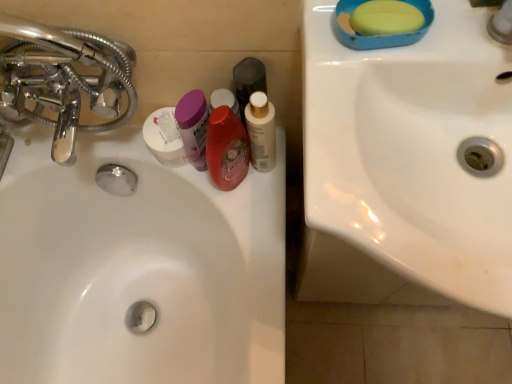
Question: From the image's perspective, does purple plastic container at center, the fourth mouthwash when ordered from right to left, appear lower than white matte container at center?

Choices:
 (A) yes
 (B) no

Answer: (A)

Question: From a real-world perspective, is purple plastic container at center, the first mouthwash positioned from the left, under white matte container at center?

Choices:
 (A) yes
 (B) no

Answer: (B)

Question: Is white matte container at center a part of purple plastic container at center, the first mouthwash positioned from the left?

Choices:
 (A) no
 (B) yes

Answer: (A)

Question: Can you confirm if purple plastic container at center, the first mouthwash positioned from the left, is positioned to the left of white matte container at center?

Choices:
 (A) yes
 (B) no

Answer: (B)

Question: Can you confirm if purple plastic container at center, the fourth mouthwash when ordered from right to left, is wider than white matte container at center?

Choices:
 (A) yes
 (B) no

Answer: (B)

Question: Is translucent purple mouthwash at center, which is the second mouthwash in left-to-right order, inside or outside of white matte container at center?

Choices:
 (A) inside
 (B) outside

Answer: (B)

Question: From a real-world perspective, is translucent purple mouthwash at center, the third mouthwash from the right, above or below white matte container at center?

Choices:
 (A) below
 (B) above

Answer: (B)

Question: Is translucent purple mouthwash at center, the third mouthwash from the right, bigger or smaller than white matte container at center?

Choices:
 (A) big
 (B) small

Answer: (A)

Question: Visually, is translucent purple mouthwash at center, the third mouthwash from the right, positioned to the left or to the right of white matte container at center?

Choices:
 (A) left
 (B) right

Answer: (B)

Question: Is white glossy sink at upper right, which is counted as the first sink, starting from the front, bigger or smaller than chrome metallic faucet at left?

Choices:
 (A) small
 (B) big

Answer: (B)

Question: Looking at their shapes, would you say white glossy sink at upper right, which is counted as the first sink, starting from the front, is wider or thinner than chrome metallic faucet at left?

Choices:
 (A) wide
 (B) thin

Answer: (A)

Question: Relative to chrome metallic faucet at left, is white glossy sink at upper right, the first sink viewed from the right, in front or behind?

Choices:
 (A) front
 (B) behind

Answer: (A)

Question: Which is correct: white glossy sink at upper right, the first sink viewed from the right, is inside chrome metallic faucet at left, or outside of it?

Choices:
 (A) outside
 (B) inside

Answer: (A)

Question: Considering the positions of white glossy mouthwash at center, the 4th mouthwash when ordered from left to right, and white glossy sink at center, which appears as the 1th sink when viewed from the back, in the image, is white glossy mouthwash at center, the 4th mouthwash when ordered from left to right, bigger or smaller than white glossy sink at center, which appears as the 1th sink when viewed from the back,?

Choices:
 (A) big
 (B) small

Answer: (B)

Question: Does point (265, 107) appear closer or farther from the camera than point (42, 139)?

Choices:
 (A) farther
 (B) closer

Answer: (B)